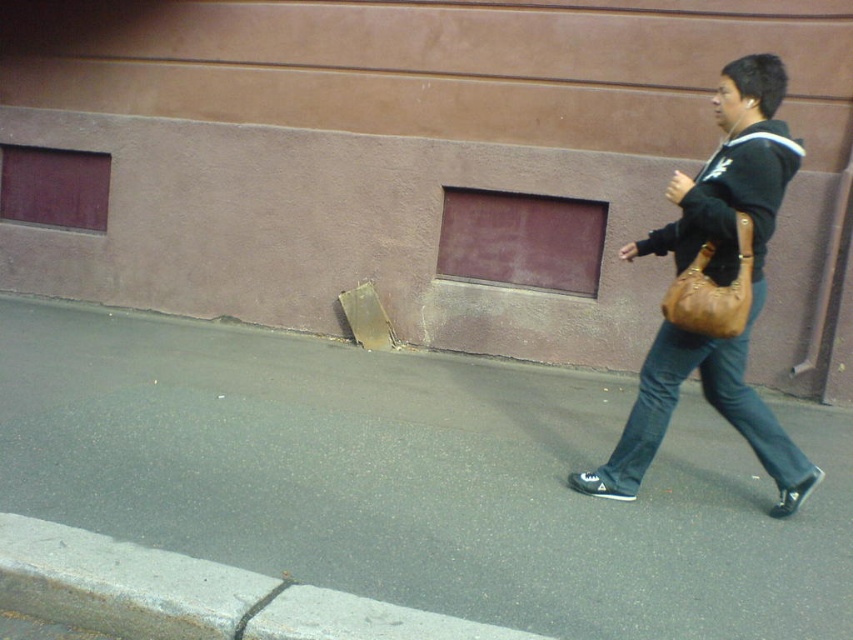
Who is more distant from viewer, (144,333) or (595,481)?

Positioned behind is point (144,333).

What do you see at coordinates (415, 477) in the screenshot? This screenshot has height=640, width=853. I see `gray asphalt at lower center` at bounding box center [415, 477].

Who is more distant from viewer, (407, 582) or (621, 444)?

Positioned behind is point (621, 444).

At what (x,y) coordinates should I click in order to perform the action: click on gray asphalt at lower center. Please return your answer as a coordinate pair (x, y). The height and width of the screenshot is (640, 853). Looking at the image, I should click on coord(415,477).

Can you confirm if brown leather bag at right is bigger than dark blue denim jeans at right?

Yes.

Is point (634, 248) closer to camera compared to point (657, 436)?

That is False.

At what (x,y) coordinates should I click in order to perform the action: click on brown leather bag at right. Please return your answer as a coordinate pair (x, y). The height and width of the screenshot is (640, 853). Looking at the image, I should click on (717, 284).

Describe the element at coordinates (190, 595) in the screenshot. I see `gray concrete curb at lower left` at that location.

Between point (131, 616) and point (636, 429), which one is positioned behind?

Positioned behind is point (636, 429).

Locate an element on the screen. This screenshot has height=640, width=853. gray concrete curb at lower left is located at coordinates (190, 595).